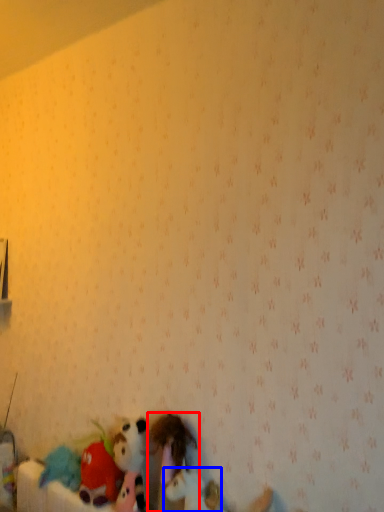
Question: Which of the following is the closest to the observer, toy (highlighted by a red box) or toy (highlighted by a blue box)?

Choices:
 (A) toy
 (B) toy

Answer: (B)